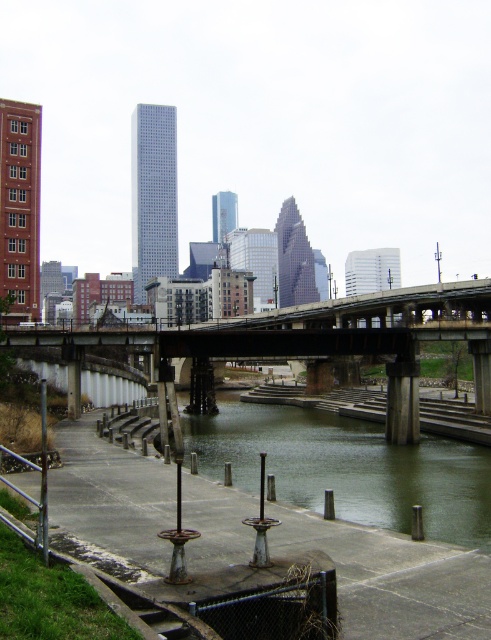
You are a delivery drone that needs to fly over the green concrete river at center and the concrete bridge at center. What is the minimum vertical clearance you need to maintain to safely pass between them?

The green concrete river at center and concrete bridge at center are 10.39 meters apart, so the minimum vertical clearance required is 10.39 meters to safely pass between them.

You are a city planner analyzing the urban layout. Given the green concrete river at center and the concrete bridge at center, which one has a greater width?

The concrete bridge at center has a greater width than the green concrete river at center.